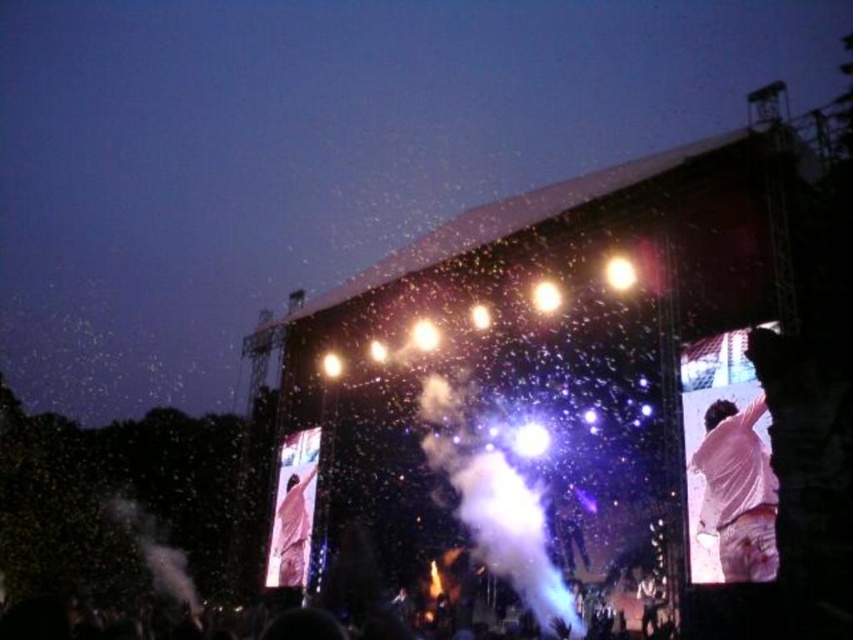
Question: Can you confirm if black matte crowd at lower center is thinner than white matte shirt at center?

Choices:
 (A) yes
 (B) no

Answer: (B)

Question: Which point is closer to the camera?

Choices:
 (A) white matte shirt at upper right
 (B) black matte crowd at lower center

Answer: (A)

Question: Where is white matte shirt at upper right located in relation to white matte shirt at center in the image?

Choices:
 (A) left
 (B) right

Answer: (B)

Question: Among these points, which one is farthest from the camera?

Choices:
 (A) (764, 465)
 (B) (303, 545)
 (C) (61, 627)

Answer: (B)

Question: Based on their relative distances, which object is farther from the white matte shirt at center?

Choices:
 (A) white matte shirt at upper right
 (B) black matte crowd at lower center

Answer: (A)

Question: Does white matte shirt at upper right lie in front of black matte crowd at lower center?

Choices:
 (A) yes
 (B) no

Answer: (A)